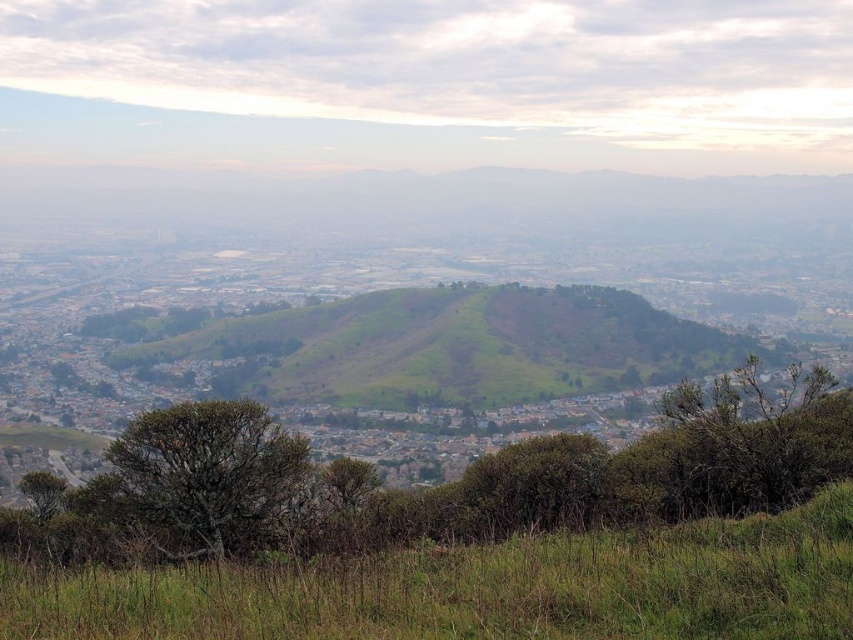
Looking at this image, you are standing at the top of the hill and looking down at the green leafy shrub at center and the green leafy tree at center. Which one is more to the right?

The green leafy shrub at center is positioned on the right side of green leafy tree at center, so the shrub is more to the right.